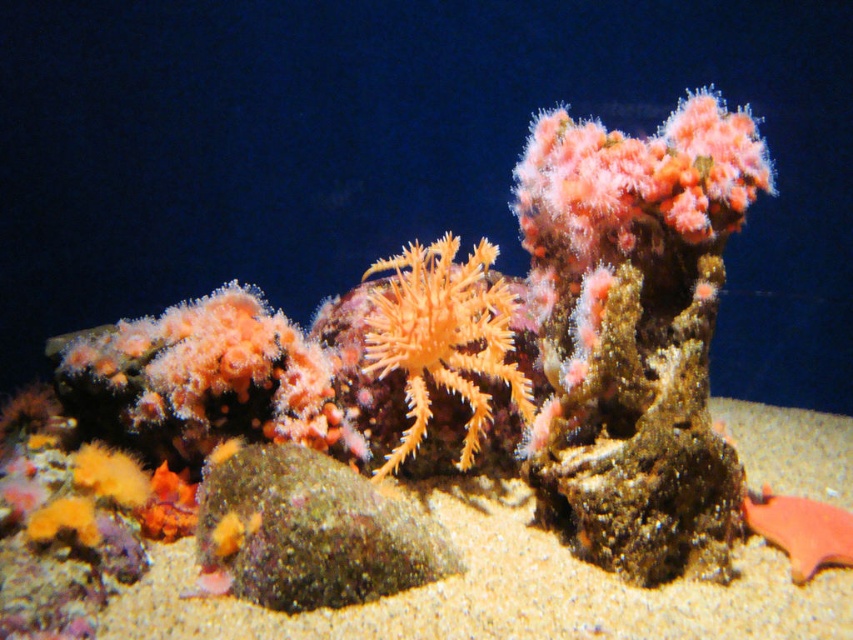
Who is shorter, sandy textured sand at center or orange soft coral at center?

sandy textured sand at center

Which is in front, point (779, 611) or point (460, 324)?

Positioned in front is point (779, 611).

Identify the location of sandy textured sand at center. The width and height of the screenshot is (853, 640). (503, 592).

Image resolution: width=853 pixels, height=640 pixels. In order to click on sandy textured sand at center in this screenshot , I will do `click(503, 592)`.

Does sandy textured sand at center appear under smooth orange fish at lower right?

Actually, sandy textured sand at center is above smooth orange fish at lower right.

What do you see at coordinates (503, 592) in the screenshot? The height and width of the screenshot is (640, 853). I see `sandy textured sand at center` at bounding box center [503, 592].

Where is `sandy textured sand at center`? The width and height of the screenshot is (853, 640). sandy textured sand at center is located at coordinates (503, 592).

Between orange soft coral at center and smooth orange fish at lower right, which one is positioned lower?

smooth orange fish at lower right is lower down.

Who is more distant from viewer, (x=465, y=326) or (x=793, y=550)?

The point (x=465, y=326) is behind.

Image resolution: width=853 pixels, height=640 pixels. What do you see at coordinates (444, 337) in the screenshot?
I see `orange soft coral at center` at bounding box center [444, 337].

I want to click on orange soft coral at center, so click(444, 337).